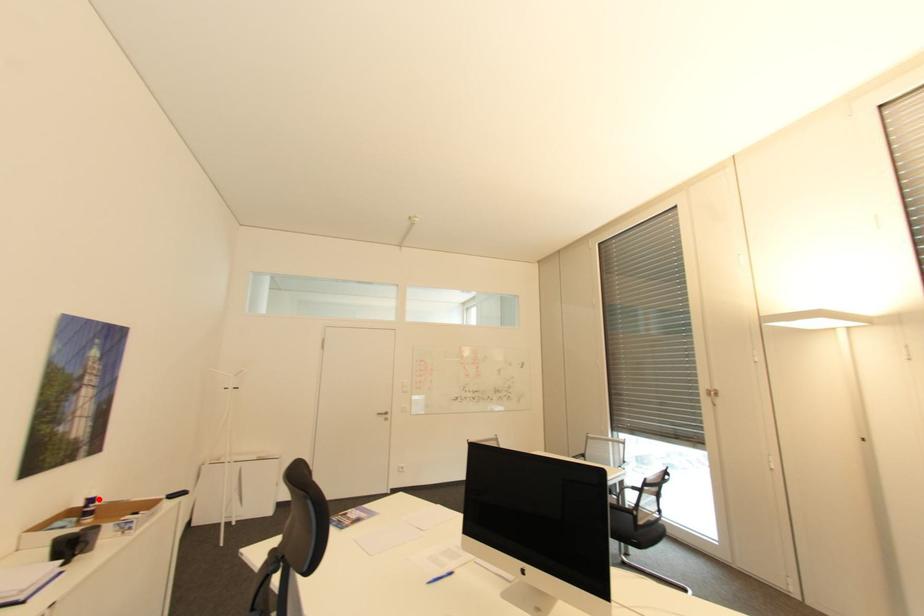
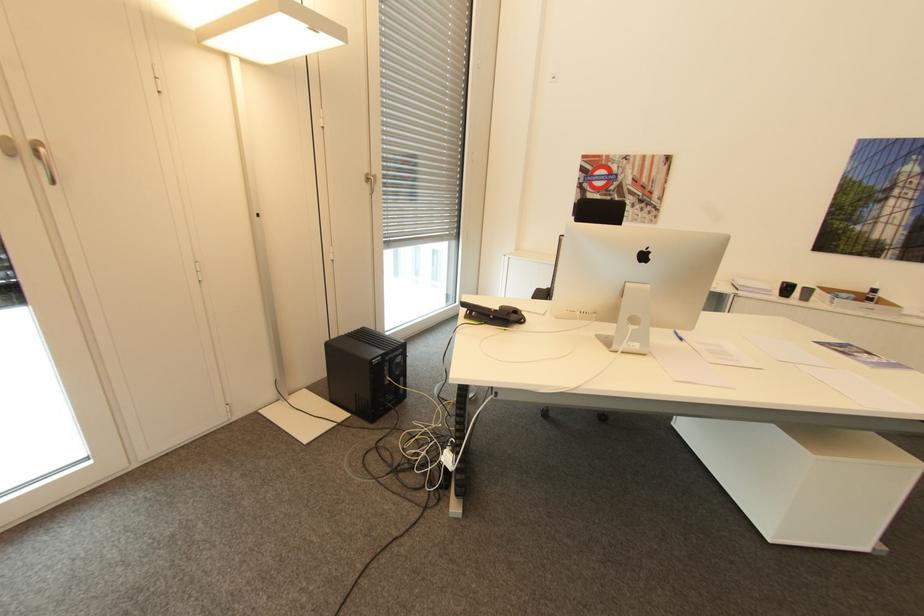
The point at the highlighted location is marked in the first image. Where is the corresponding point in the second image?

(879, 290)